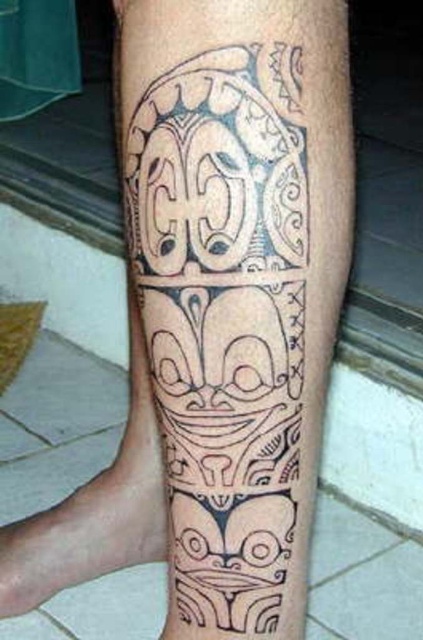
Is black ink tattoo at center above black ink tattoo at lower left?

Yes, black ink tattoo at center is above black ink tattoo at lower left.

Does black ink tattoo at center have a greater height compared to black ink tattoo at lower left?

Indeed, black ink tattoo at center has a greater height compared to black ink tattoo at lower left.

Which is behind, point (297, 614) or point (91, 522)?

The point (91, 522) is behind.

I want to click on black ink tattoo at center, so click(225, 330).